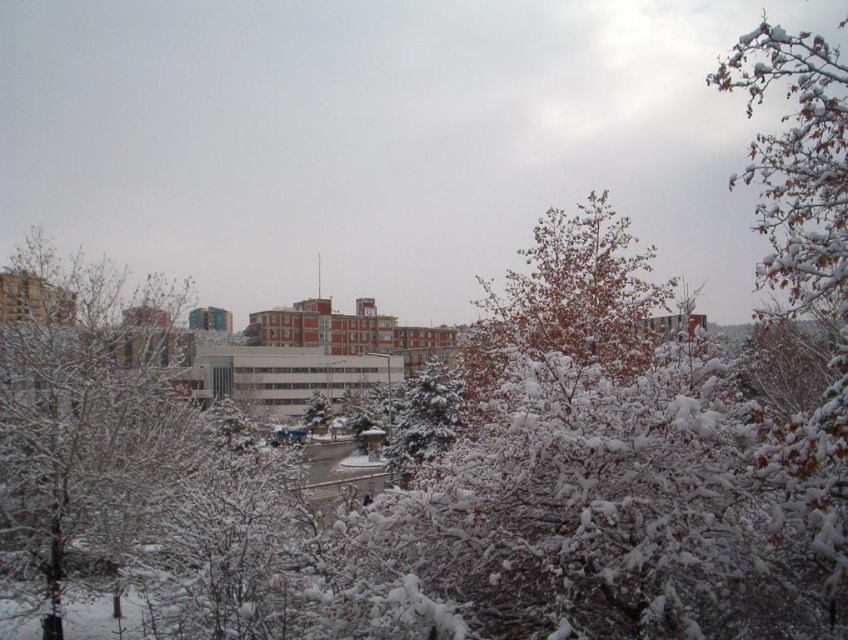
Can you confirm if snow-covered branches at upper right is smaller than green matte tree at center?

No, snow-covered branches at upper right is not smaller than green matte tree at center.

Which is in front, point (801, 180) or point (322, 406)?

Point (801, 180)

This screenshot has height=640, width=848. What are the coordinates of `snow-covered branches at upper right` in the screenshot? It's located at (805, 259).